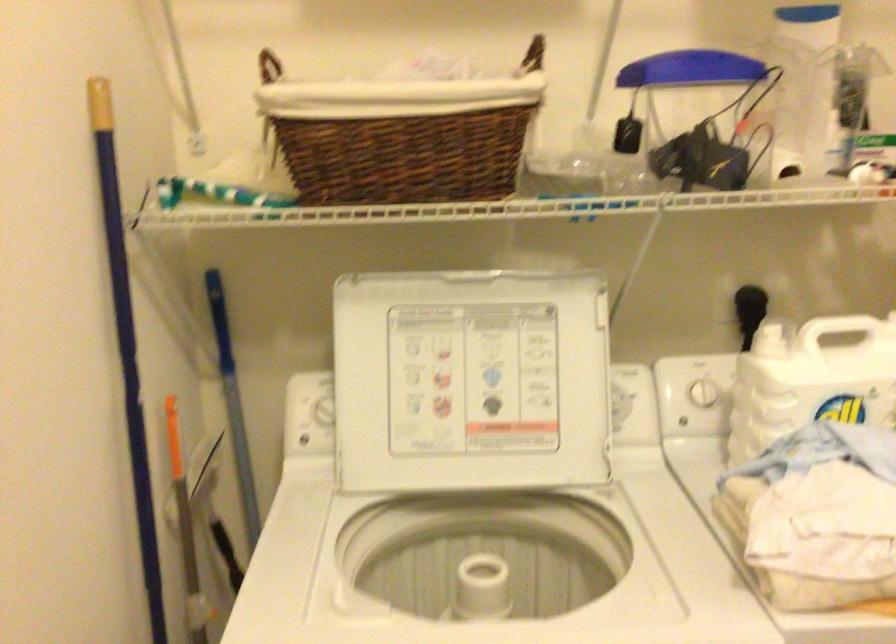
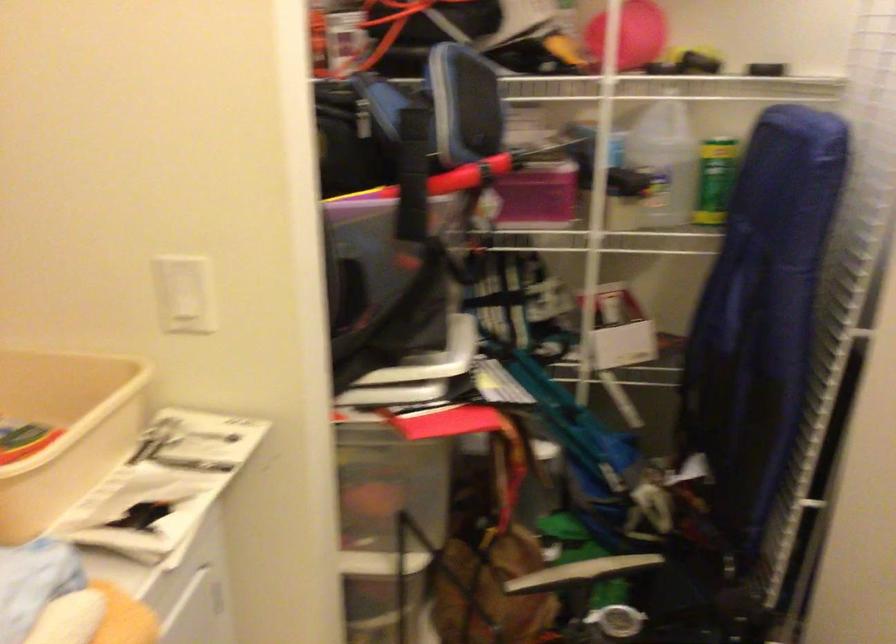
First-person continuous shooting, in which direction is the camera rotating?

The camera's rotation is toward right-down.